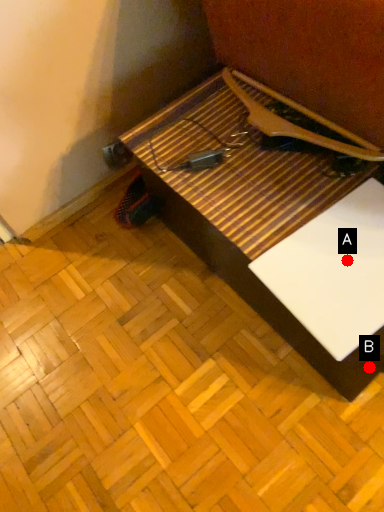
Question: Two points are circled on the image, labeled by A and B beside each circle. Which point appears farthest from the camera in this image?

Choices:
 (A) A is further
 (B) B is further

Answer: (A)